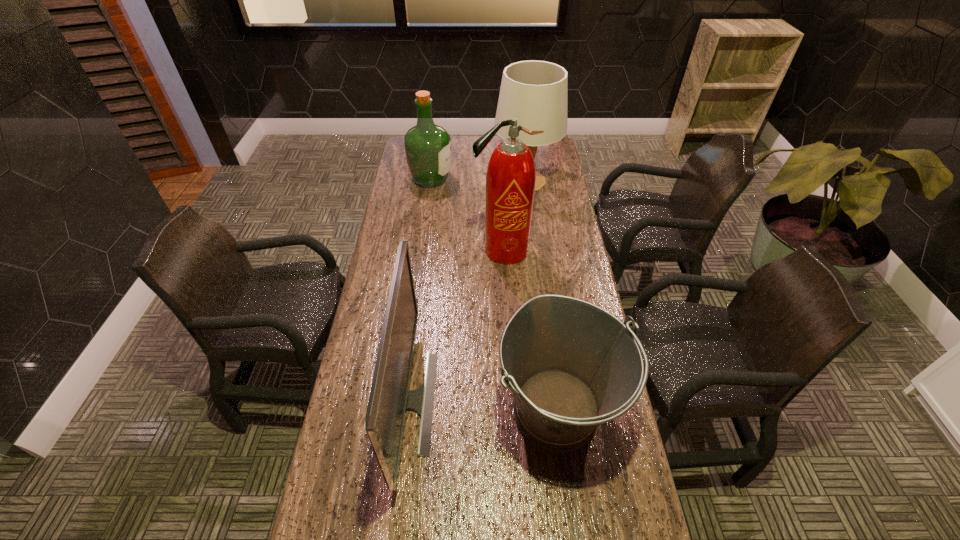
I want to click on vacant region that satisfies the following two spatial constraints: 1. on the front-facing side of the fire extinguisher; 2. on the left side of the liquor, so click(x=421, y=251).

This screenshot has height=540, width=960. I want to click on free space that satisfies the following two spatial constraints: 1. on the front side of the shortest object; 2. on the right side of the fire extinguisher, so pyautogui.click(x=512, y=410).

The height and width of the screenshot is (540, 960). What are the coordinates of `vacant position in the image that satisfies the following two spatial constraints: 1. on the front-facing side of the liquor; 2. on the left side of the table lamp` in the screenshot? It's located at (431, 181).

Identify the location of free space that satisfies the following two spatial constraints: 1. on the back side of the shortest object; 2. on the front-facing side of the liquor. This screenshot has height=540, width=960. (527, 180).